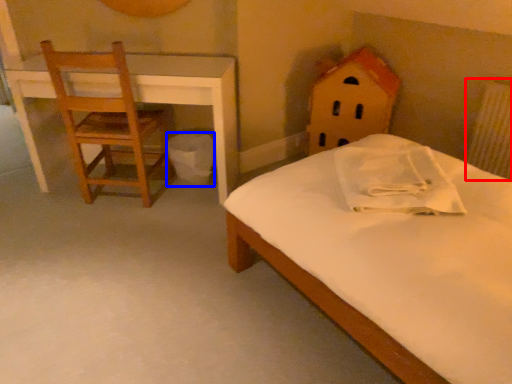
Question: Among these objects, which one is nearest to the camera, radiator (highlighted by a red box) or trash bin/can (highlighted by a blue box)?

Choices:
 (A) radiator
 (B) trash bin/can

Answer: (A)